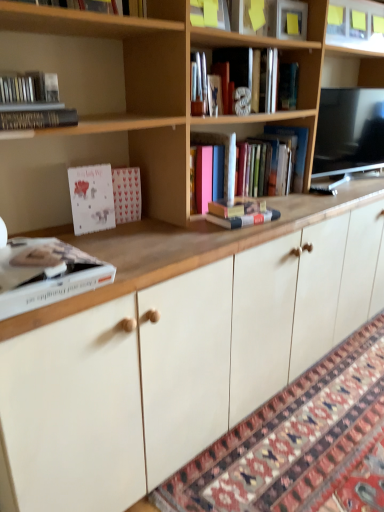
Where is `vacant region above patterned carpet at lower right (from a real-world perspective)`? vacant region above patterned carpet at lower right (from a real-world perspective) is located at coordinates (324, 434).